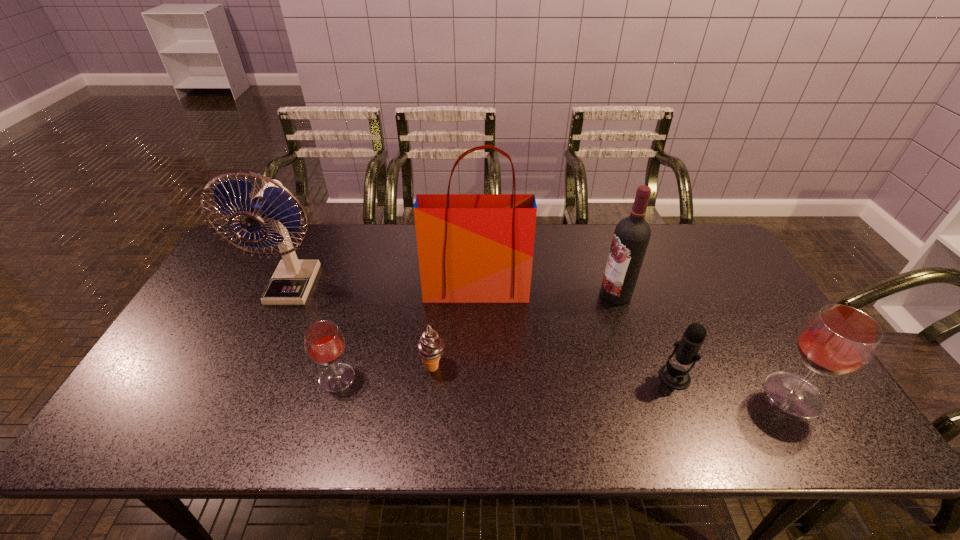
Where is `microphone located at the near edge`? microphone located at the near edge is located at coordinates (674, 376).

At what (x,y) coordinates should I click in order to perform the action: click on object situated at the left edge. Please return your answer as a coordinate pair (x, y). This screenshot has height=540, width=960. Looking at the image, I should click on (292, 280).

You are a GUI agent. You are given a task and a screenshot of the screen. Output one action in this format:
    pyautogui.click(x=<x>, y=<y>)
    Task: Click on the object that is at the right edge
    This screenshot has width=960, height=540.
    Given the screenshot: What is the action you would take?
    pyautogui.click(x=837, y=340)

What are the coordinates of `object positioned at the far left corner` in the screenshot? It's located at (292, 280).

Where is `object at the near right corner`? object at the near right corner is located at coordinates (837, 340).

In the image, there is a desktop. At what (x,y) coordinates should I click in order to perform the action: click on vacant region at the far edge. Please return your answer as a coordinate pair (x, y). Looking at the image, I should click on 356,250.

Where is `vacant space at the near edge`? This screenshot has width=960, height=540. vacant space at the near edge is located at coordinates (422, 404).

Image resolution: width=960 pixels, height=540 pixels. I want to click on free spot at the right edge of the desktop, so click(x=799, y=366).

Locate an element on the screen. vacant space at the far right corner of the desktop is located at coordinates (708, 231).

Where is `vacant area that lies between the shorter wineglass and the microphone`? vacant area that lies between the shorter wineglass and the microphone is located at coordinates (506, 377).